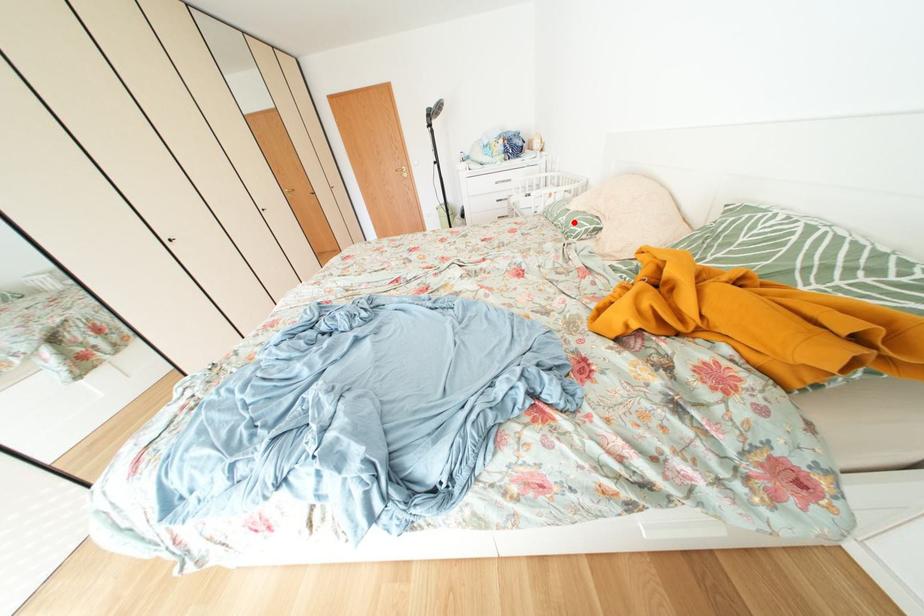
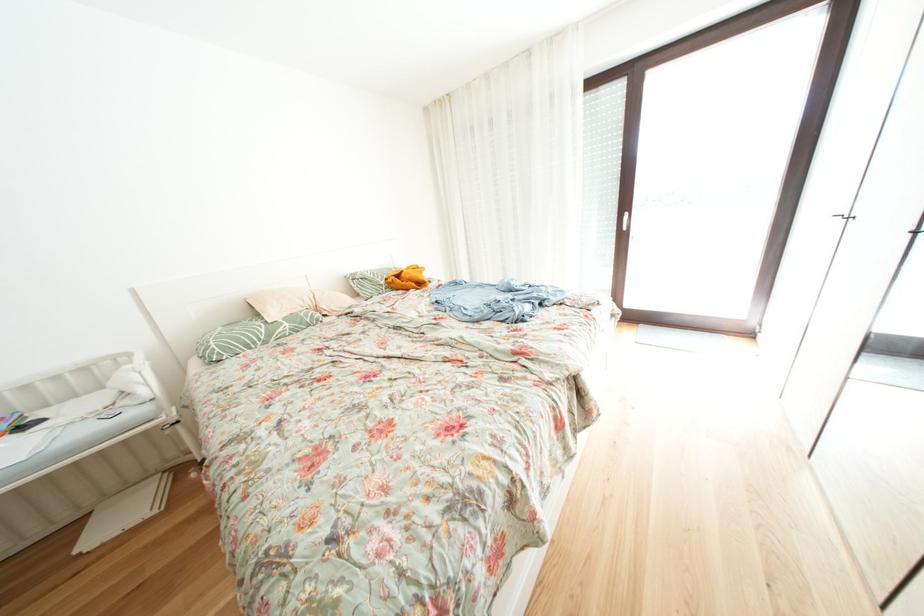
Locate, in the second image, the point that corresponds to the highlighted location in the first image.

(296, 329)